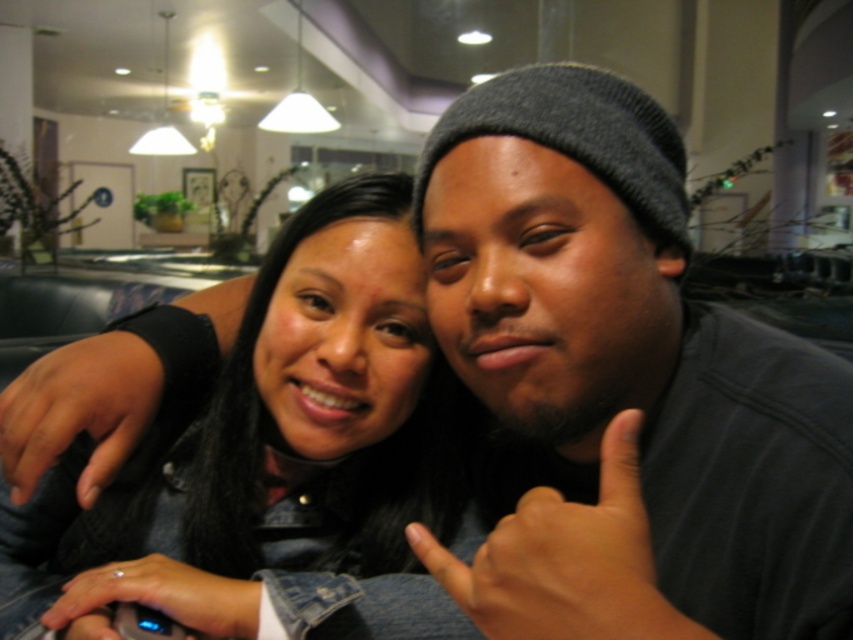
Question: Can you confirm if denim jacket at center is positioned below silver metallic ring at lower left?

Choices:
 (A) no
 (B) yes

Answer: (A)

Question: From the image, what is the correct spatial relationship of denim jacket at center in relation to silver metallic ring at lower left?

Choices:
 (A) below
 (B) above

Answer: (B)

Question: Which point appears closest to the camera in this image?

Choices:
 (A) (479, 557)
 (B) (90, 589)

Answer: (A)

Question: Based on their relative distances, which object is nearer to the dark blue denim jacket at lower left?

Choices:
 (A) dark skin tone hand at center
 (B) denim jacket at center
 (C) silver metallic ring at lower left

Answer: (B)

Question: Does dark skin tone hand at center have a larger size compared to dark blue denim jacket at lower left?

Choices:
 (A) no
 (B) yes

Answer: (A)

Question: Which of these objects is positioned farthest from the dark skin tone hand at center?

Choices:
 (A) denim jacket at center
 (B) dark blue denim jacket at lower left
 (C) silver metallic ring at lower left

Answer: (B)